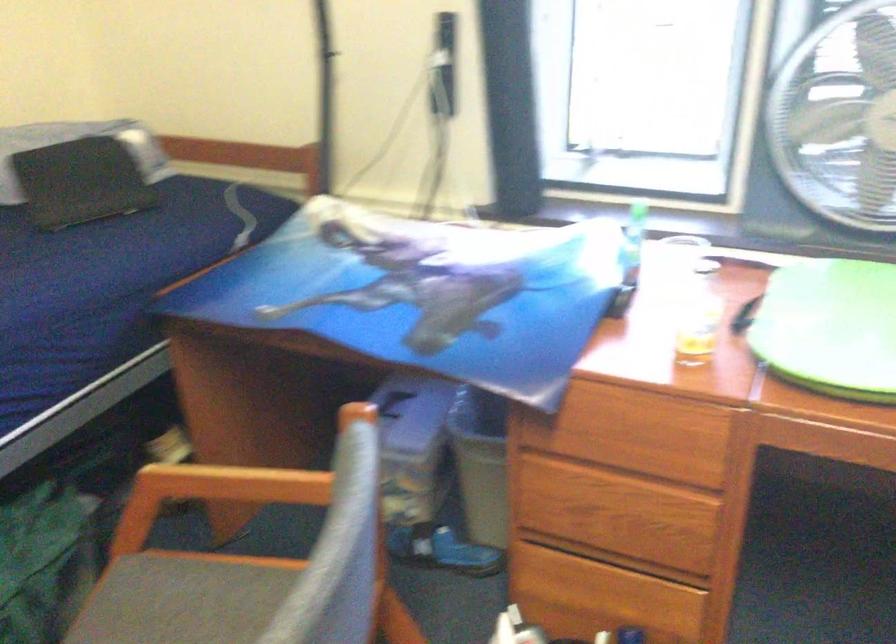
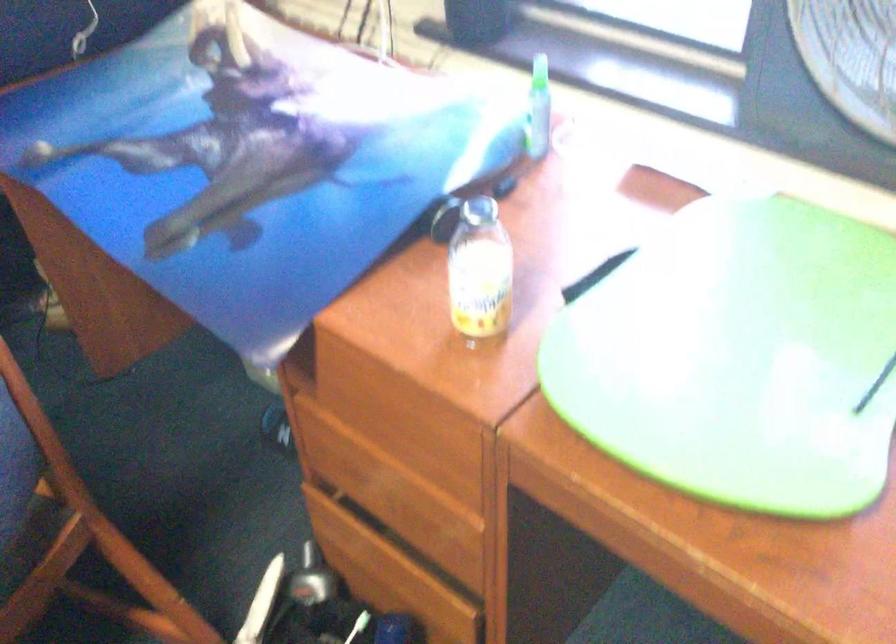
In a continuous first-person perspective shot, in which direction is the camera moving?

The cameraman moved toward right, forward.